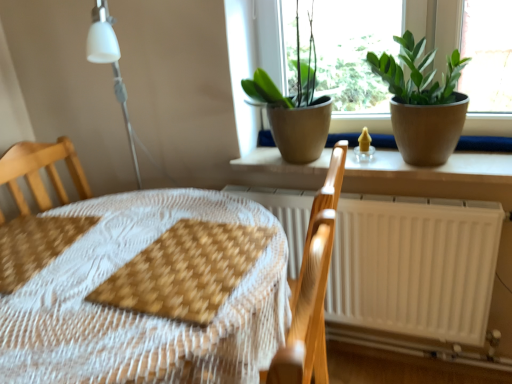
Where is `vacant space that is in between brown woven placemat at lower left, placed as the first sheet when sorted from left to right, and brown woven placemat at center, arranged as the 2th sheet when viewed from the left`? This screenshot has width=512, height=384. vacant space that is in between brown woven placemat at lower left, placed as the first sheet when sorted from left to right, and brown woven placemat at center, arranged as the 2th sheet when viewed from the left is located at coordinates (101, 256).